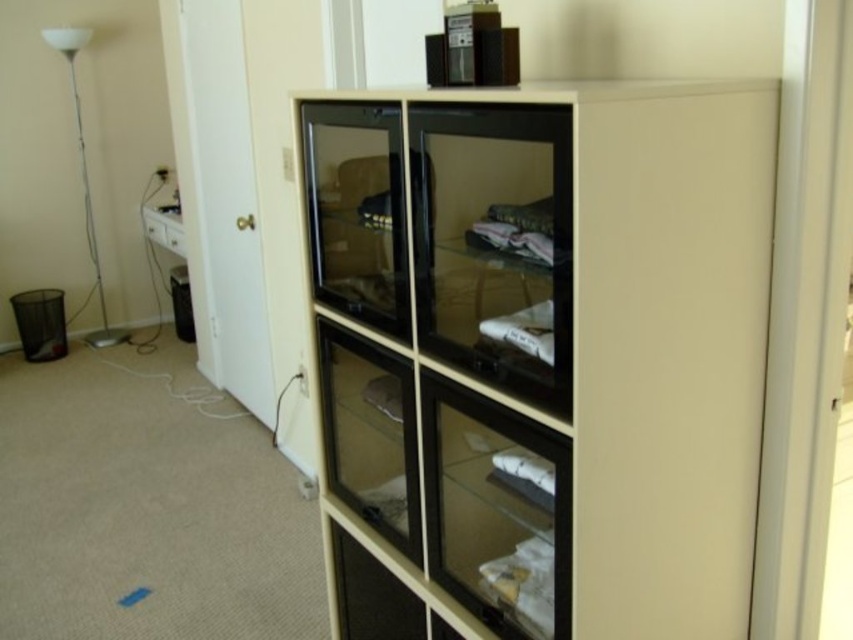
You are standing in the room and want to move from the beige matte cabinet at center to the white glossy floor lamp at left. Which direction should you move to get closer to the lamp?

Since the beige matte cabinet at center is in front of the white glossy floor lamp at left, you should move backward to get closer to the lamp.

You are organizing the room and need to place a large poster that requires a surface larger than the white fabric at center. Can the transparent glass door at center accommodate the poster?

The transparent glass door at center is larger in size than the white fabric at center, so yes, the poster can be placed on the transparent glass door at center since it has a larger surface area.